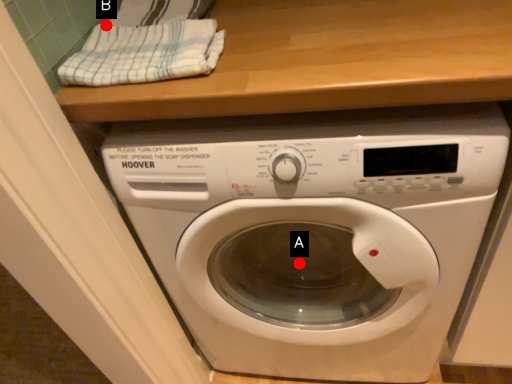
Question: Two points are circled on the image, labeled by A and B beside each circle. Which point is farther from the camera taking this photo?

Choices:
 (A) A is further
 (B) B is further

Answer: (A)